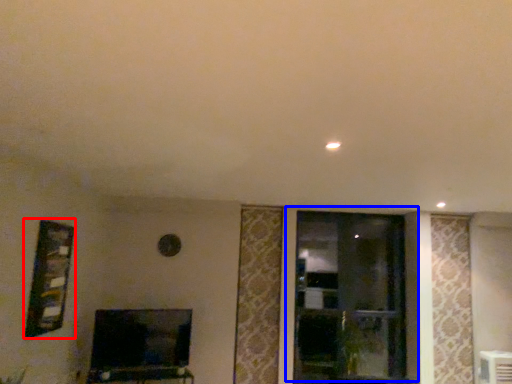
Question: Which of the following is the farthest to the observer, picture frame (highlighted by a red box) or window (highlighted by a blue box)?

Choices:
 (A) picture frame
 (B) window

Answer: (B)